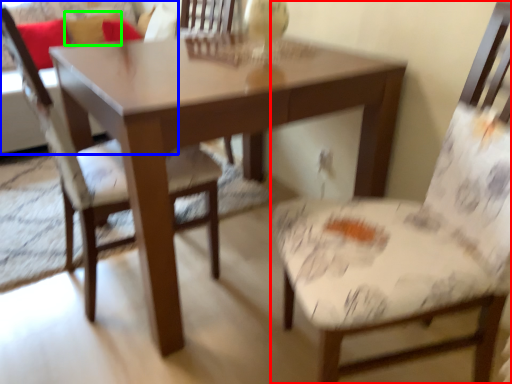
Question: Which object is positioned closest to chair (highlighted by a red box)? Select from couch (highlighted by a blue box) and pillow (highlighted by a green box).

Choices:
 (A) couch
 (B) pillow

Answer: (A)